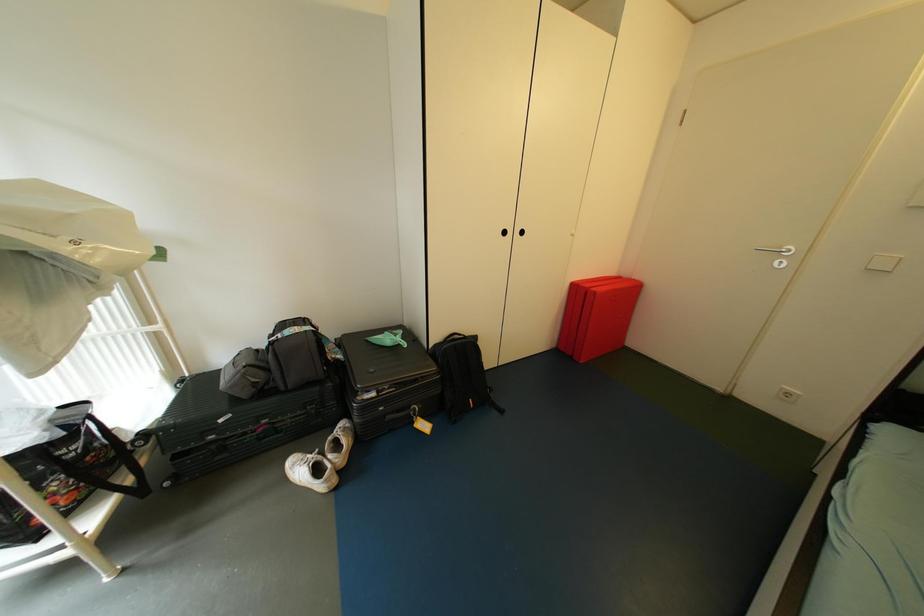
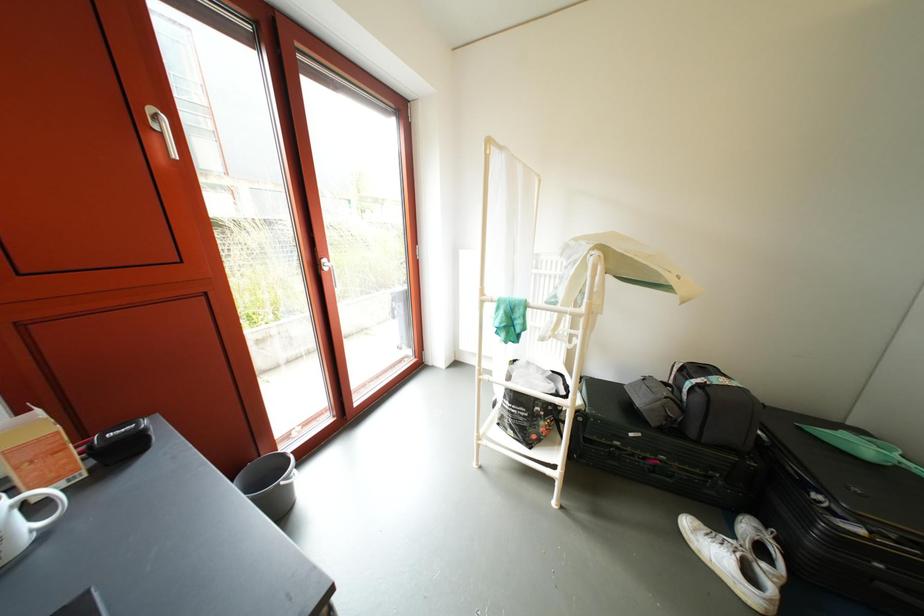
Question: The camera is either moving clockwise (left) or counter-clockwise (right) around the object. The first image is from the beginning of the video and the second image is from the end. Is the camera moving left or right when shooting the video?

Choices:
 (A) Left
 (B) Right

Answer: (B)